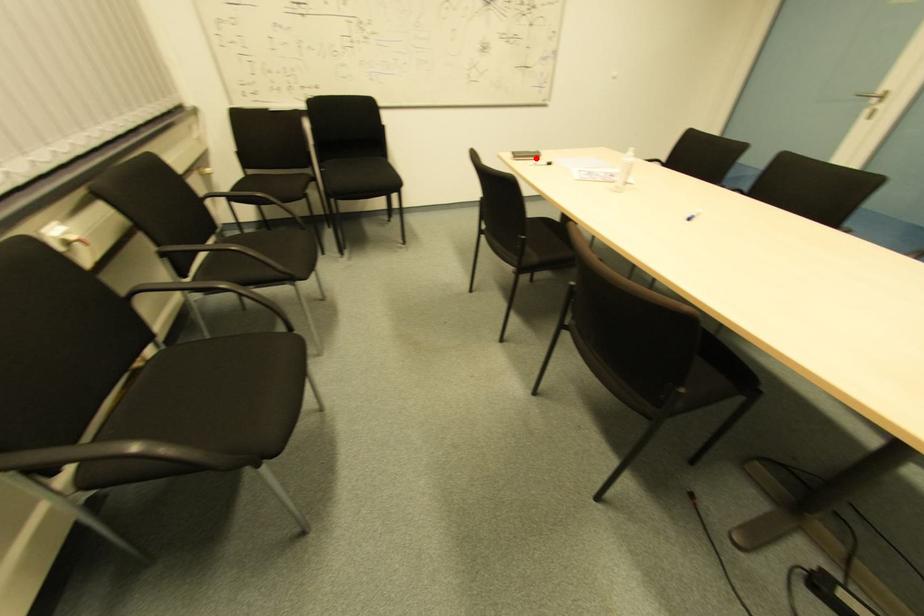
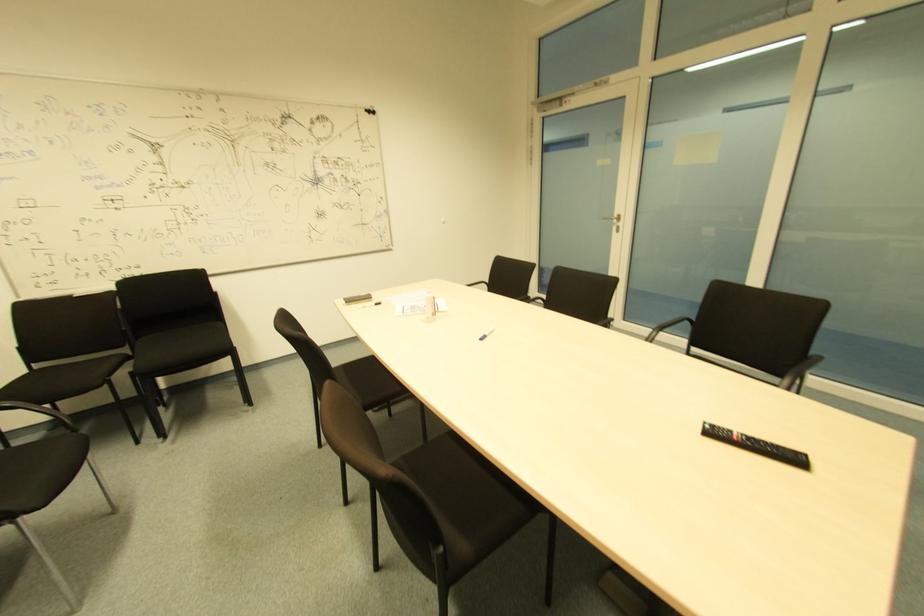
Locate, in the second image, the point that corresponds to the highlighted location in the first image.

(365, 301)